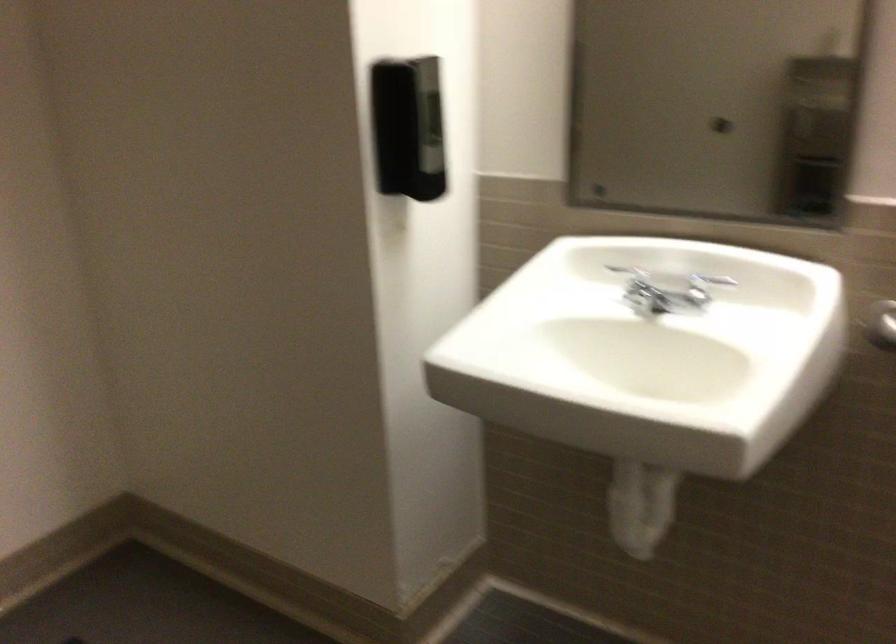
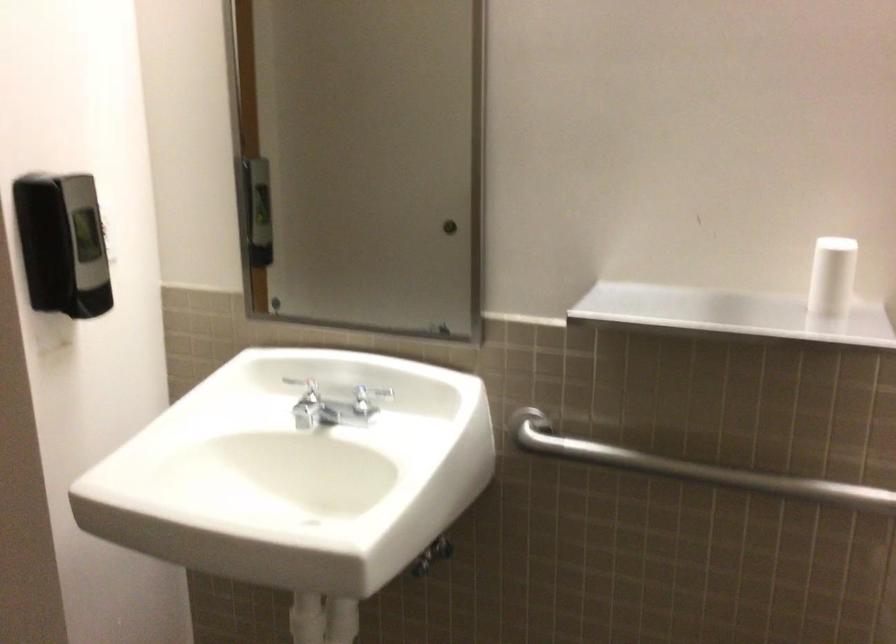
Question: In a continuous first-person perspective shot, in which direction is the camera moving?

Choices:
 (A) Left
 (B) Right
 (C) Forward
 (D) Backward

Answer: (B)